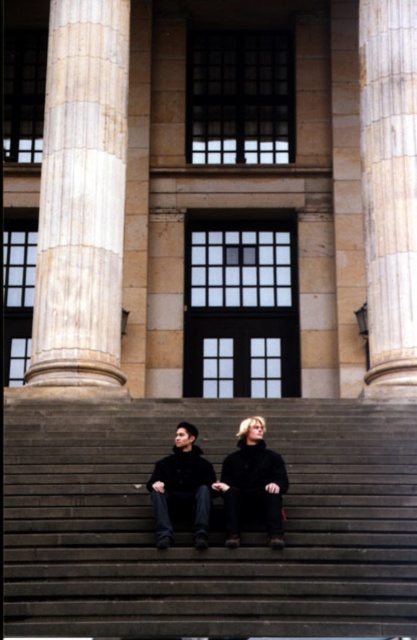
Is smooth concrete stairs at center bigger than marble column at right?

Indeed, smooth concrete stairs at center has a larger size compared to marble column at right.

What do you see at coordinates (213, 532) in the screenshot?
I see `smooth concrete stairs at center` at bounding box center [213, 532].

Identify the location of smooth concrete stairs at center. The width and height of the screenshot is (417, 640). (213, 532).

Identify the location of white marble column at left. This screenshot has width=417, height=640. (82, 198).

Which is more to the right, white marble column at left or marble column at right?

From the viewer's perspective, marble column at right appears more on the right side.

Does point (118, 196) come farther from viewer compared to point (412, 385)?

Yes, point (118, 196) is farther from viewer.

Locate an element on the screen. This screenshot has height=640, width=417. white marble column at left is located at coordinates (82, 198).

Can you confirm if white marble column at left is positioned to the left of black woolen coat at center?

Correct, you'll find white marble column at left to the left of black woolen coat at center.

Does white marble column at left have a larger size compared to black woolen coat at center?

Yes, white marble column at left is bigger than black woolen coat at center.

Does point (92, 195) come in front of point (236, 476)?

No.

Find the location of a particular element. white marble column at left is located at coordinates (82, 198).